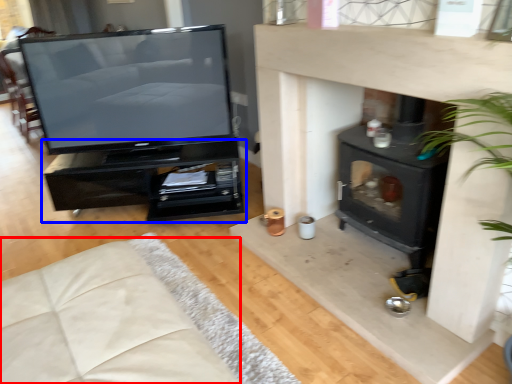
Question: Which object is closer to the camera taking this photo, couch (highlighted by a red box) or furniture (highlighted by a blue box)?

Choices:
 (A) couch
 (B) furniture

Answer: (A)